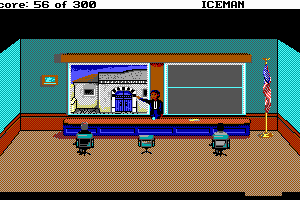
The image size is (300, 200). What are the coordinates of `screen` in the screenshot? It's located at (112, 92).